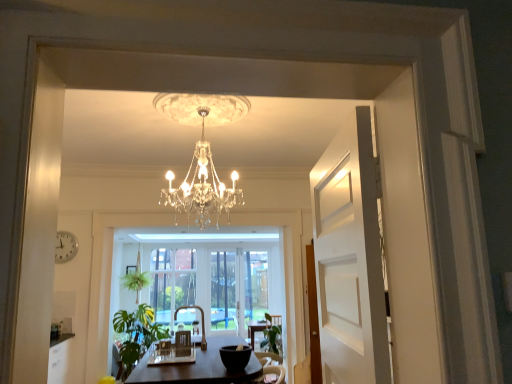
Question: Is white wooden door at right turned away from green leafy plant at lower left?

Choices:
 (A) no
 (B) yes

Answer: (A)

Question: Are white wooden door at right and green leafy plant at lower left beside each other?

Choices:
 (A) no
 (B) yes

Answer: (A)

Question: Would you say white wooden door at right is a long distance from green leafy plant at lower left?

Choices:
 (A) yes
 (B) no

Answer: (A)

Question: Can you confirm if white wooden door at right is positioned to the right of green leafy plant at lower left?

Choices:
 (A) no
 (B) yes

Answer: (B)

Question: Can you confirm if white wooden door at right is thinner than green leafy plant at lower left?

Choices:
 (A) yes
 (B) no

Answer: (A)

Question: Is white wooden door at right shorter than green leafy plant at lower left?

Choices:
 (A) yes
 (B) no

Answer: (A)

Question: Does clear glass window screen at center, which appears as the second window screen when viewed from the right, come in front of green leafy plant at lower left?

Choices:
 (A) no
 (B) yes

Answer: (A)

Question: Is the surface of clear glass window screen at center, which appears as the second window screen when viewed from the right, in direct contact with green leafy plant at lower left?

Choices:
 (A) yes
 (B) no

Answer: (B)

Question: Can you confirm if clear glass window screen at center, which appears as the second window screen when viewed from the right, is positioned to the left of green leafy plant at lower left?

Choices:
 (A) yes
 (B) no

Answer: (A)

Question: Considering the relative sizes of clear glass window screen at center, which appears as the second window screen when viewed from the right, and green leafy plant at lower left in the image provided, is clear glass window screen at center, which appears as the second window screen when viewed from the right, shorter than green leafy plant at lower left?

Choices:
 (A) no
 (B) yes

Answer: (A)

Question: Would you say clear glass window screen at center, placed as the 1th window screen when sorted from left to right, contains green leafy plant at lower left?

Choices:
 (A) no
 (B) yes

Answer: (A)

Question: Does clear glass window screen at center, placed as the 1th window screen when sorted from left to right, appear on the right side of green leafy plant at lower left?

Choices:
 (A) no
 (B) yes

Answer: (A)

Question: Considering the relative sizes of green leafy plant at lower center, the 1th plant positioned from the right, and green leafy plant at lower left in the image provided, is green leafy plant at lower center, the 1th plant positioned from the right, wider than green leafy plant at lower left?

Choices:
 (A) no
 (B) yes

Answer: (A)